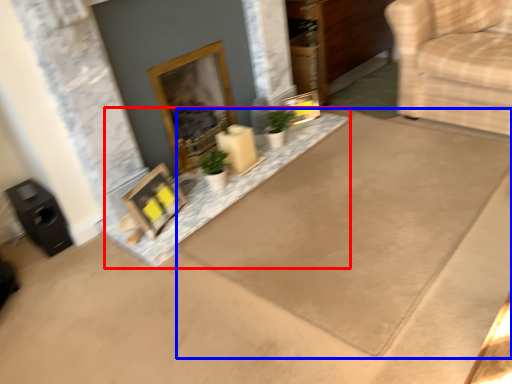
Question: Among these objects, which one is farthest to the camera, concrete (highlighted by a red box) or doormat (highlighted by a blue box)?

Choices:
 (A) concrete
 (B) doormat

Answer: (A)